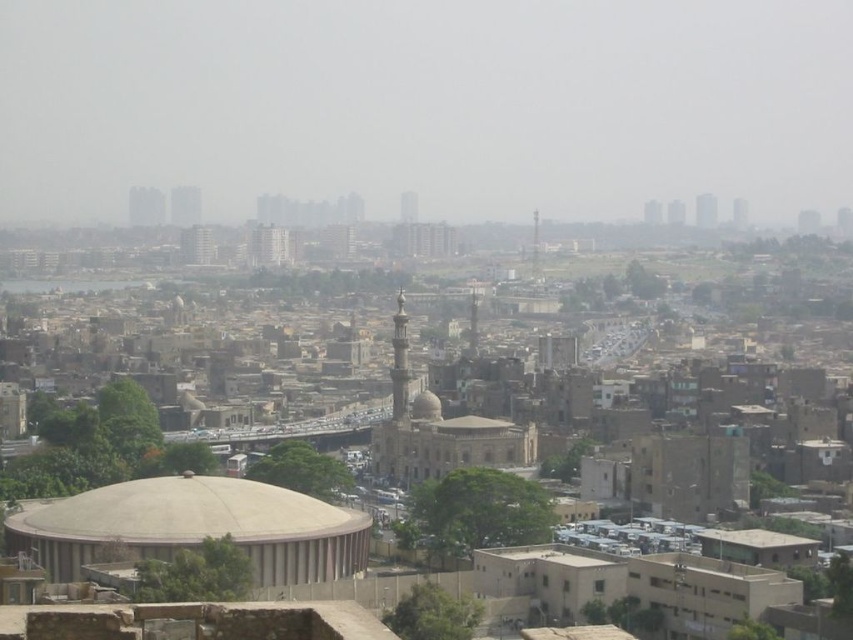
Question: Considering the real-world distances, which object is farthest from the transparent foggy skyline at upper center?

Choices:
 (A) light beige stone dome at center
 (B) beige concrete dome at center

Answer: (B)

Question: Where is transparent foggy skyline at upper center located in relation to beige concrete dome at center in the image?

Choices:
 (A) left
 (B) right

Answer: (B)

Question: Which of the following is the farthest from the observer?

Choices:
 (A) transparent foggy skyline at upper center
 (B) light beige stone dome at center

Answer: (A)

Question: From the image, what is the correct spatial relationship of transparent foggy skyline at upper center in relation to beige concrete dome at center?

Choices:
 (A) left
 (B) right

Answer: (B)

Question: Can you confirm if transparent foggy skyline at upper center is thinner than beige concrete dome at center?

Choices:
 (A) no
 (B) yes

Answer: (A)

Question: Which of the following is the closest to the observer?

Choices:
 (A) light beige stone dome at center
 (B) beige concrete dome at center
 (C) transparent foggy skyline at upper center

Answer: (B)